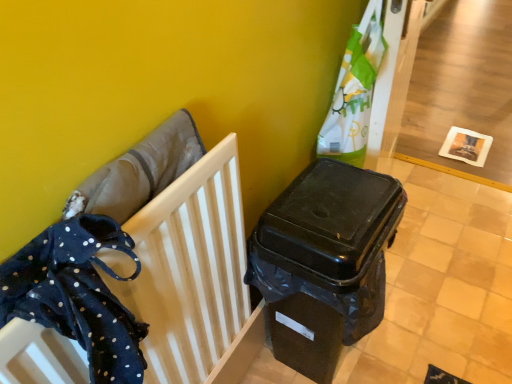
Question: From the image's perspective, is black plastic waste container at center-right positioned above or below dark blue fabric at left?

Choices:
 (A) above
 (B) below

Answer: (A)

Question: From a real-world perspective, is black plastic waste container at center-right positioned above or below dark blue fabric at left?

Choices:
 (A) above
 (B) below

Answer: (B)

Question: Which of these objects is positioned farthest from the dark blue fabric at left?

Choices:
 (A) black plastic waste container at center-right
 (B) dark blue polka dot fabric at left

Answer: (A)

Question: Considering the real-world distances, which object is farthest from the dark blue fabric at left?

Choices:
 (A) dark blue polka dot fabric at left
 (B) black plastic waste container at center-right

Answer: (B)